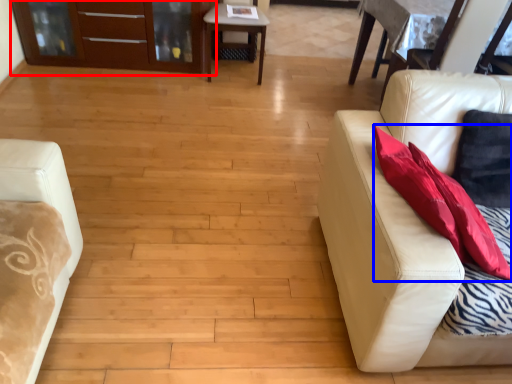
Question: Which of the following is the closest to the observer, dresser (highlighted by a red box) or throw pillow (highlighted by a blue box)?

Choices:
 (A) dresser
 (B) throw pillow

Answer: (B)